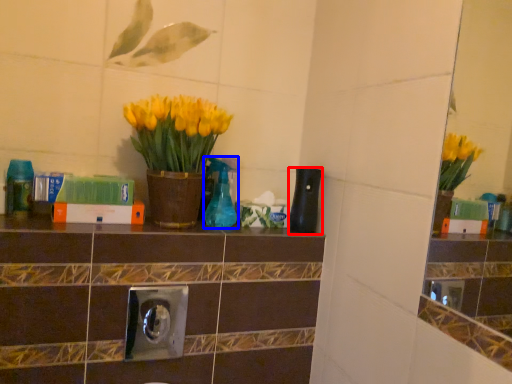
Question: Which object is closer to the camera taking this photo, bottle (highlighted by a red box) or bottle (highlighted by a blue box)?

Choices:
 (A) bottle
 (B) bottle

Answer: (B)